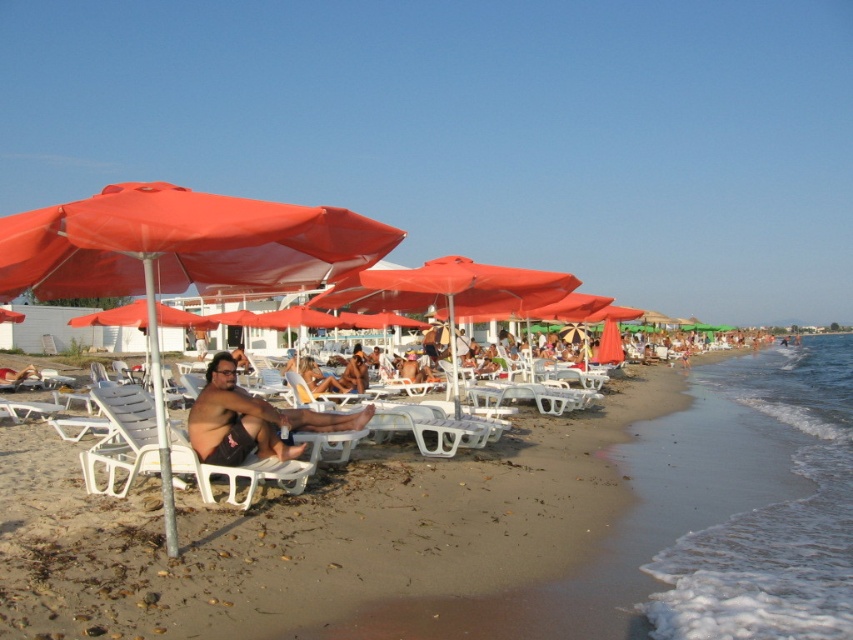
Question: Which object is positioned farthest from the sandy beach at center?

Choices:
 (A) white plastic beach chair at lower left
 (B) matte orange umbrella at left
 (C) dark brown skin at center

Answer: (B)

Question: Which of the following is the farthest from the observer?

Choices:
 (A) (134, 212)
 (B) (119, 461)
 (C) (253, 426)
 (D) (273, 545)

Answer: (C)

Question: Which is farther from the dark brown skin at center?

Choices:
 (A) sandy beach at center
 (B) matte orange umbrella at left
 (C) white plastic beach chair at lower left

Answer: (A)

Question: Is matte orange umbrella at left in front of white plastic beach chair at lower left?

Choices:
 (A) no
 (B) yes

Answer: (B)

Question: Is dark brown skin at center positioned behind white plastic beach chair at lower left?

Choices:
 (A) no
 (B) yes

Answer: (B)

Question: Does sandy beach at center have a lesser width compared to white plastic beach chair at lower left?

Choices:
 (A) yes
 (B) no

Answer: (B)